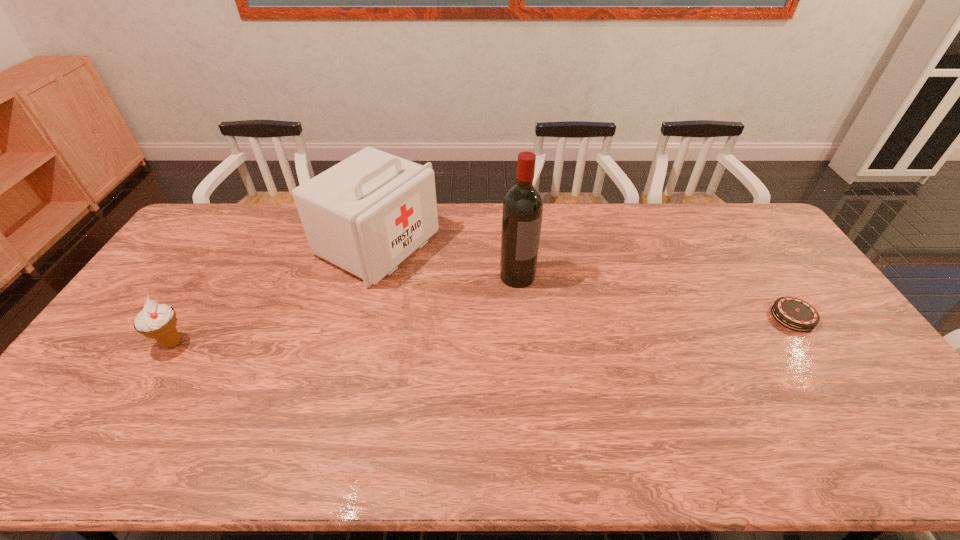
The image size is (960, 540). What are the coordinates of `free space located on the front-facing side of the third shortest object` in the screenshot? It's located at (465, 287).

The height and width of the screenshot is (540, 960). I want to click on free location located 0.210m on the front-facing side of the third shortest object, so click(x=478, y=293).

Locate an element on the screen. The image size is (960, 540). free spot located 0.120m on the front-facing side of the third shortest object is located at coordinates (455, 282).

Find the location of a particular element. vacant area situated on the label of the second object from right to left is located at coordinates (578, 346).

I want to click on free region located 0.140m on the label of the second object from right to left, so [x=553, y=317].

The image size is (960, 540). I want to click on blank space located 0.180m on the label of the second object from right to left, so click(561, 326).

Find the location of a particular element. object that is at the far edge is located at coordinates (368, 213).

This screenshot has height=540, width=960. I want to click on object located at the left edge, so click(x=158, y=321).

This screenshot has width=960, height=540. I want to click on object located in the right edge section of the desktop, so [x=795, y=314].

Identify the location of vacant space at the far edge of the desktop. This screenshot has height=540, width=960. (695, 230).